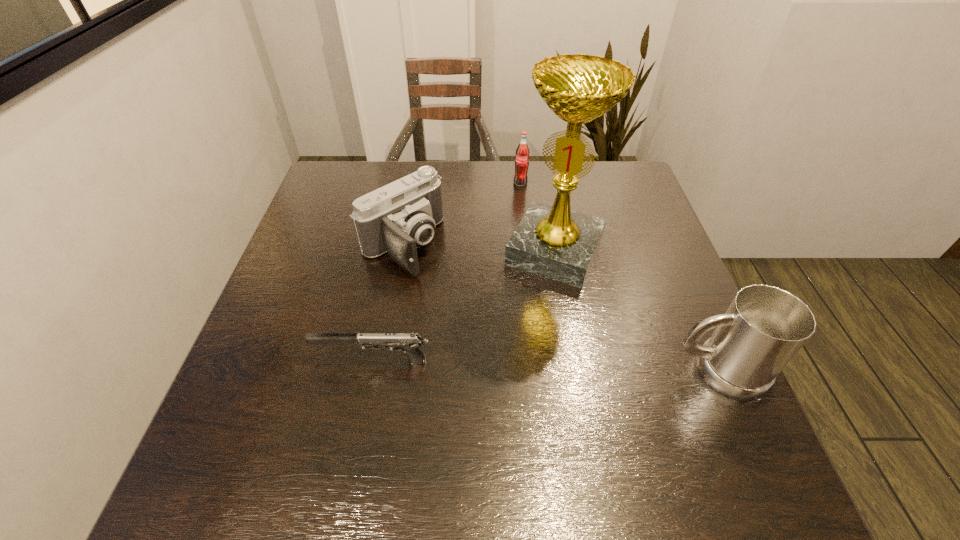
In order to click on object that stands as the second closest to the mug in this screenshot , I will do pos(409,343).

Select which object is the fourth closest to the camera. Please provide its 2D coordinates. Your answer should be formatted as a tuple, i.e. [(x, y)], where the tuple contains the x and y coordinates of a point satisfying the conditions above.

[(764, 327)]

Identify the location of vacant space that satisfies the following two spatial constraints: 1. on the front side of the rightmost object; 2. on the side of the camera with the handle. The width and height of the screenshot is (960, 540). (379, 371).